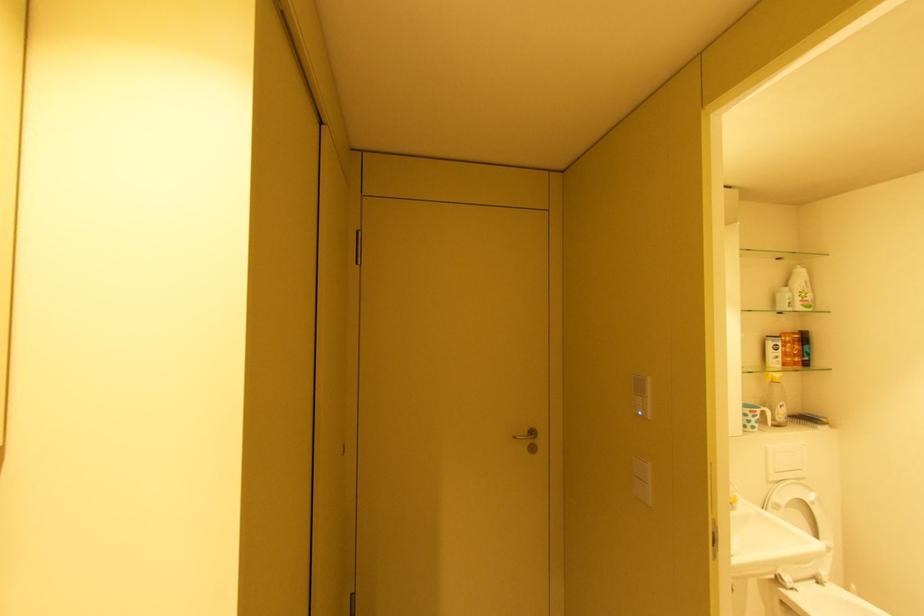
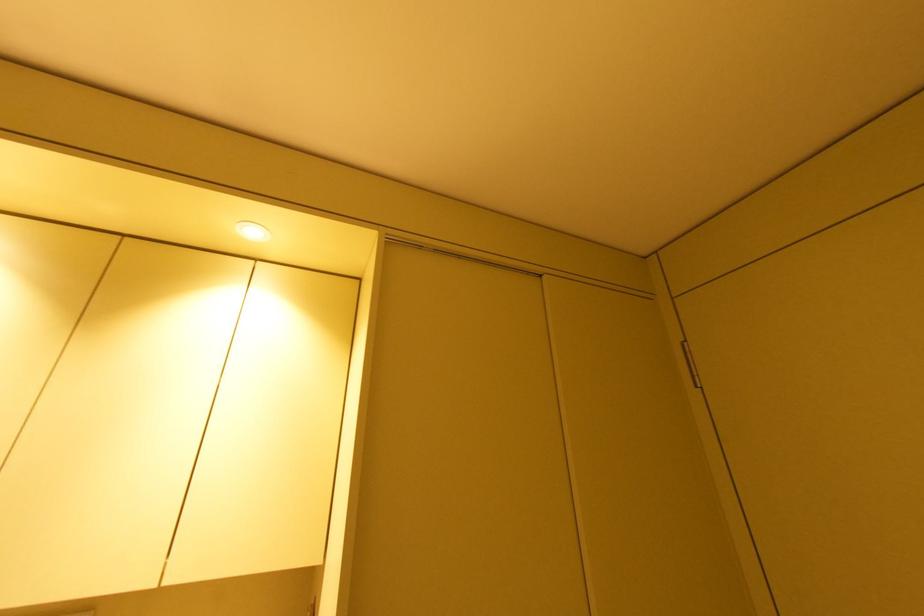
First-person continuous shooting, in which direction is the camera rotating?

The camera's rotation is toward left-up.